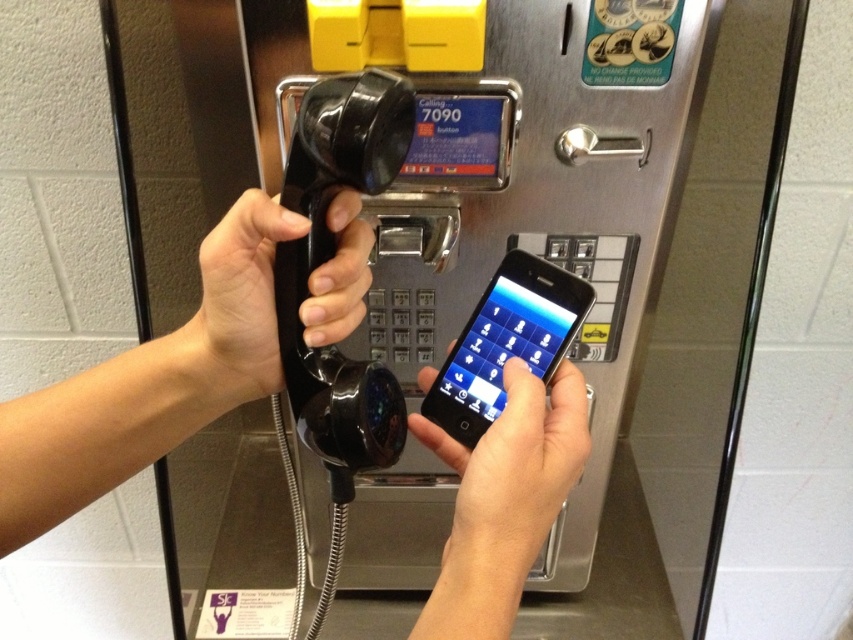
You are a delivery person who needs to place both the metallic gray payphone at center and the matte black phone at center on a shelf that can only hold items up to 1 meter in height. Based on their sizes, will both items fit on the shelf?

The metallic gray payphone at center has a greater height compared to matte black phone at center. Since the shelf can only hold items up to 1 meter in height, both items will fit as long as the tallest item, the metallic gray payphone at center, is under 1 meter. However, the exact height isn

You are a delivery robot that needs to place a small package between the matte black phone at center and the black glossy smartphone at center. The package is 4 centimeters wide. Will it fit in the space between them?

The space between the matte black phone at center and the black glossy smartphone at center is 3.76 centimeters. Since the package is 4 centimeters wide, it will not fit in the space between them.